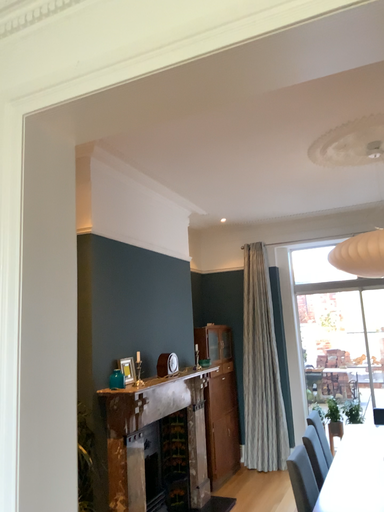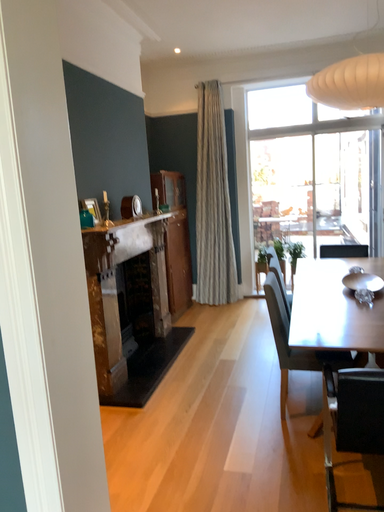
Question: Which way did the camera rotate in the video?

Choices:
 (A) rotated downward
 (B) rotated upward

Answer: (A)